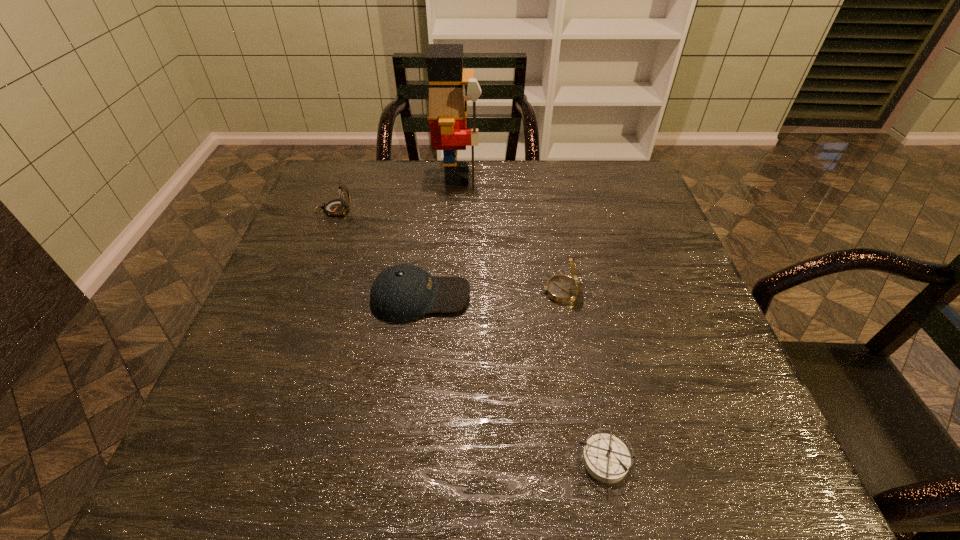
Image resolution: width=960 pixels, height=540 pixels. Identify the location of vacant space located with the dial facing the second nearest compass. (369, 292).

Where is `free region located 0.190m with the dial facing the second nearest compass`? This screenshot has height=540, width=960. free region located 0.190m with the dial facing the second nearest compass is located at coordinates (454, 292).

Identify the location of vacant point located 0.270m with the dial facing the second nearest compass. (419, 292).

Identify the location of vacant area located 0.130m on the front-facing side of the fourth tallest object. This screenshot has height=540, width=960. (529, 297).

Image resolution: width=960 pixels, height=540 pixels. I want to click on free location located 0.150m on the left of the nearest object, so click(485, 460).

You are a GUI agent. You are given a task and a screenshot of the screen. Output one action in this format:
    pyautogui.click(x=<x>, y=<y>)
    Task: Click on the nutcracker located in the far edge section of the desktop
    This screenshot has width=960, height=540.
    Given the screenshot: What is the action you would take?
    pyautogui.click(x=448, y=109)

In order to click on compass that is at the far edge in this screenshot , I will do `click(336, 207)`.

You are a GUI agent. You are given a task and a screenshot of the screen. Output one action in this format:
    pyautogui.click(x=<x>, y=<y>)
    Task: Click on the object present at the near edge
    The image size is (960, 540).
    Given the screenshot: What is the action you would take?
    pyautogui.click(x=606, y=458)

Identify the location of object that is at the left edge. (336, 207).

Find the location of a particular element. object that is at the far left corner is located at coordinates (336, 207).